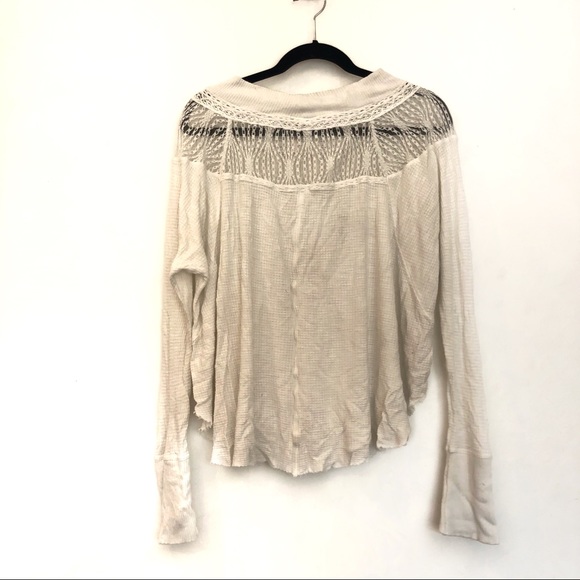
You are a GUI agent. You are given a task and a screenshot of the screen. Output one action in this format:
    pyautogui.click(x=<x>, y=<y>)
    Task: Click on the hanger
    
    Given the screenshot: What is the action you would take?
    pyautogui.click(x=306, y=47)